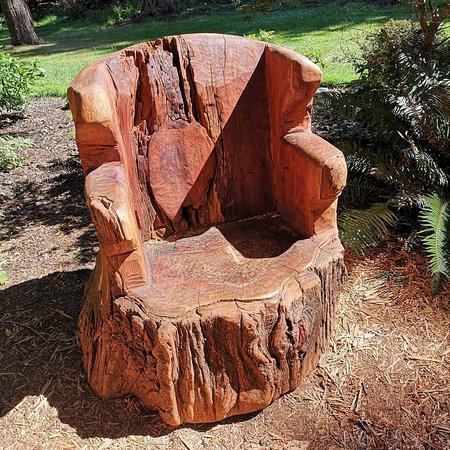
The width and height of the screenshot is (450, 450). I want to click on tree stump chair, so click(x=236, y=278).